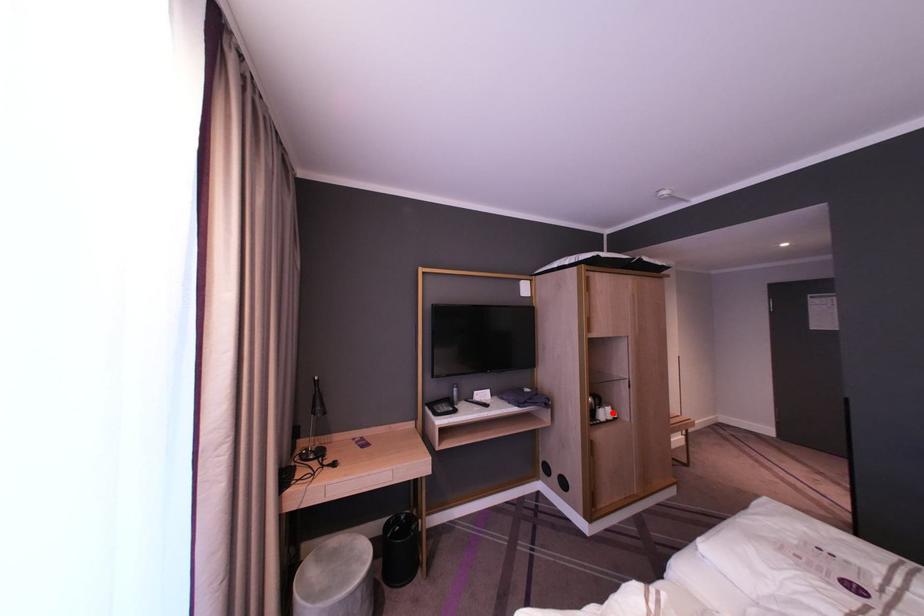
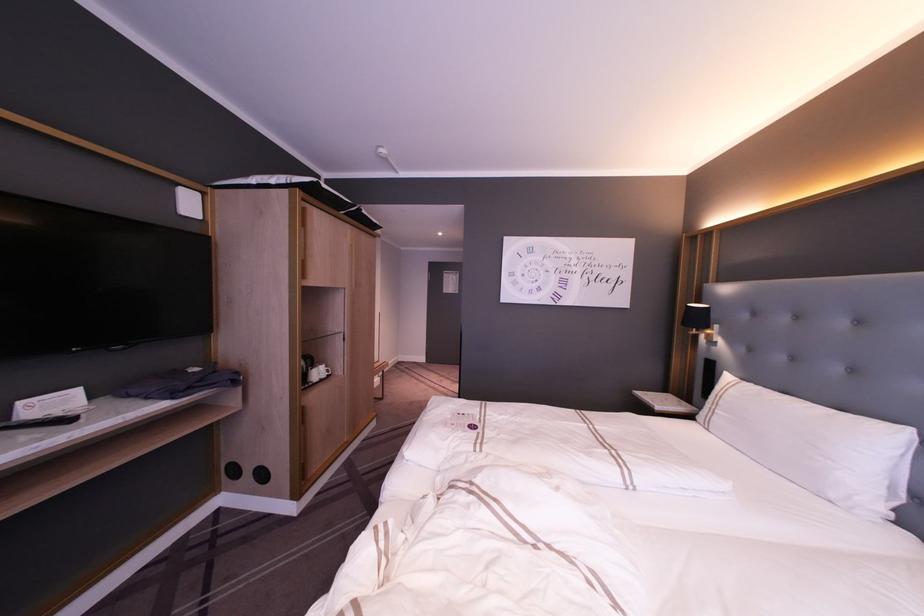
Question: I am providing you with two images of the same scene from different viewpoints. A red point is shown in image1. For the corresponding object point in image2, is it positioned nearer or farther from the camera?

Choices:
 (A) Nearer
 (B) Farther

Answer: (A)